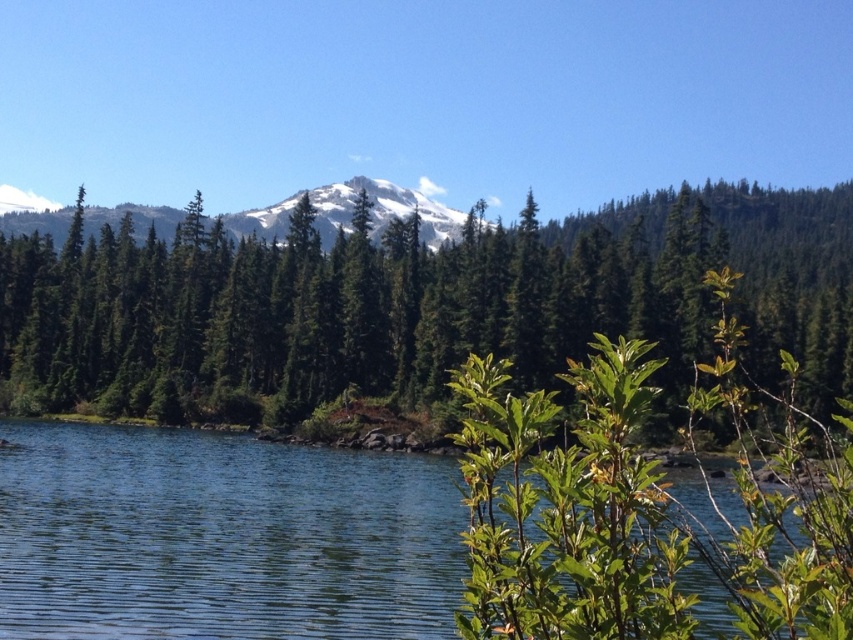
Question: Which point appears farthest from the camera in this image?

Choices:
 (A) (109, 486)
 (B) (447, 228)

Answer: (B)

Question: Is green matte tree at center thinner than snowy white mountain at center?

Choices:
 (A) yes
 (B) no

Answer: (B)

Question: Does green matte tree at center appear on the left side of snowy white mountain at center?

Choices:
 (A) yes
 (B) no

Answer: (B)

Question: Can you confirm if green matte tree at center is wider than clear blue water at center?

Choices:
 (A) yes
 (B) no

Answer: (A)

Question: Which object is positioned farthest from the clear blue water at center?

Choices:
 (A) snowy white mountain at center
 (B) green matte tree at center

Answer: (A)

Question: Which object is positioned closest to the green matte tree at center?

Choices:
 (A) clear blue water at center
 (B) snowy white mountain at center

Answer: (B)